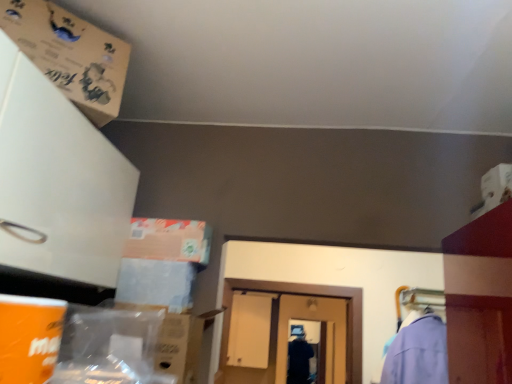
Question: Is brown cardboard box at upper left, which appears as the first cardboard box when viewed from the top, in front of or behind matte cardboard box at lower left, which is the 2th cardboard box in top-to-bottom order, in the image?

Choices:
 (A) front
 (B) behind

Answer: (A)

Question: Is brown cardboard box at upper left, which appears as the first cardboard box when viewed from the top, wider or thinner than matte cardboard box at lower left, which is the 2th cardboard box in top-to-bottom order?

Choices:
 (A) thin
 (B) wide

Answer: (A)

Question: Based on their positions, is brown cardboard box at upper left, marked as the 2th cardboard box in a bottom-to-top arrangement, located to the left or right of matte cardboard box at lower left, which is the 2th cardboard box in top-to-bottom order?

Choices:
 (A) left
 (B) right

Answer: (A)

Question: From the image's perspective, is matte cardboard box at lower left, arranged as the first cardboard box when ordered from the bottom, above or below brown cardboard box at upper left, which appears as the first cardboard box when viewed from the top?

Choices:
 (A) above
 (B) below

Answer: (B)

Question: In the image, is matte cardboard box at lower left, arranged as the first cardboard box when ordered from the bottom, positioned in front of or behind brown cardboard box at upper left, which appears as the first cardboard box when viewed from the top?

Choices:
 (A) behind
 (B) front

Answer: (A)

Question: Which is correct: matte cardboard box at lower left, which is the 2th cardboard box in top-to-bottom order, is inside brown cardboard box at upper left, which appears as the first cardboard box when viewed from the top, or outside of it?

Choices:
 (A) outside
 (B) inside

Answer: (A)

Question: In terms of width, does matte cardboard box at lower left, which is the 2th cardboard box in top-to-bottom order, look wider or thinner when compared to brown cardboard box at upper left, which appears as the first cardboard box when viewed from the top?

Choices:
 (A) thin
 (B) wide

Answer: (B)